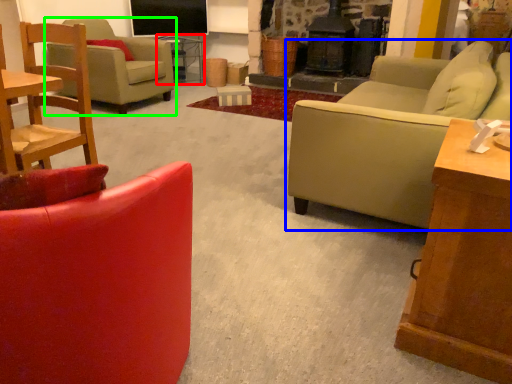
Question: Based on their relative distances, which object is nearer to side table (highlighted by a red box)? Choose from studio couch (highlighted by a blue box) and chair (highlighted by a green box).

Choices:
 (A) studio couch
 (B) chair

Answer: (B)